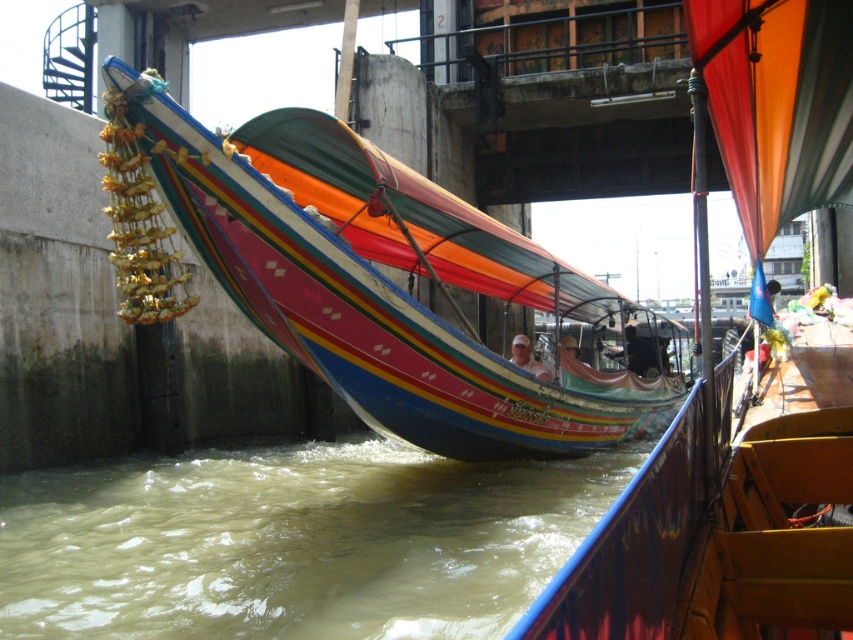
Question: Is brown murky water at lower left to the right of multicolored fabric boat at center from the viewer's perspective?

Choices:
 (A) no
 (B) yes

Answer: (A)

Question: Which point is closer to the camera taking this photo?

Choices:
 (A) (624, 456)
 (B) (595, 410)

Answer: (B)

Question: Is brown murky water at lower left wider than multicolored fabric boat at center?

Choices:
 (A) no
 (B) yes

Answer: (B)

Question: Which of the following is the closest to the observer?

Choices:
 (A) (312, 493)
 (B) (490, 428)

Answer: (B)

Question: Does brown murky water at lower left appear under multicolored fabric boat at center?

Choices:
 (A) no
 (B) yes

Answer: (B)

Question: Which of the following is the farthest from the observer?

Choices:
 (A) multicolored fabric boat at center
 (B) brown murky water at lower left

Answer: (A)